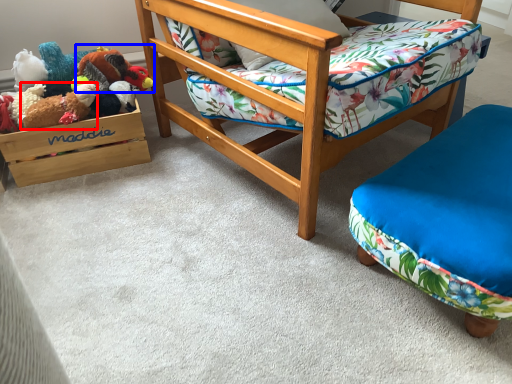
Question: Which of the following is the farthest to the observer, toy (highlighted by a red box) or toy (highlighted by a blue box)?

Choices:
 (A) toy
 (B) toy

Answer: (B)